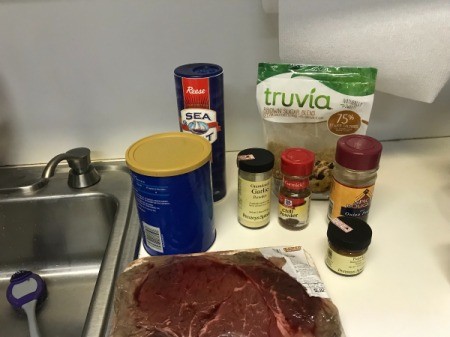
Locate an element on the screen. Image resolution: width=450 pixels, height=337 pixels. dish scrubber brush is located at coordinates (27, 291).